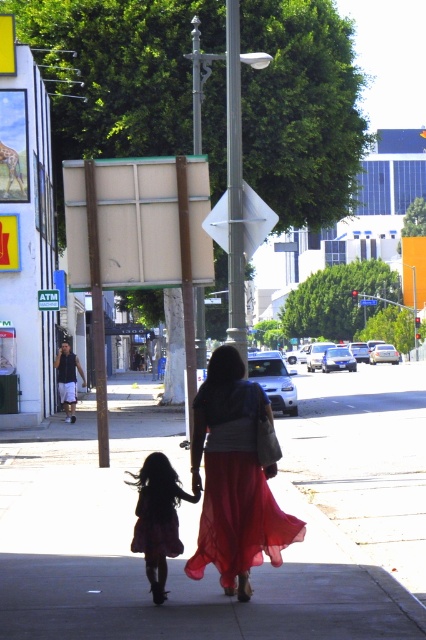
Does point (86, 628) come closer to viewer compared to point (213, 529)?

Yes, it is.

Is smooth concrete sidewalk at center in front of red chiffon dress at center?

Yes, it is in front of red chiffon dress at center.

Which is behind, point (186, 552) or point (204, 563)?

The point (186, 552) is behind.

Identify the location of smooth concrete sidewalk at center. (198, 515).

Does smooth concrete sidewalk at center have a smaller size compared to silky purple dress at lower left?

Actually, smooth concrete sidewalk at center might be larger than silky purple dress at lower left.

Is point (385, 579) in front of point (170, 512)?

No, it is not.

Where is `smooth concrete sidewalk at center`? smooth concrete sidewalk at center is located at coordinates (198, 515).

Which is more to the left, red chiffon dress at center or silky purple dress at lower left?

From the viewer's perspective, silky purple dress at lower left appears more on the left side.

Looking at this image, is the position of red chiffon dress at center more distant than that of silky purple dress at lower left?

That is False.

Where is `red chiffon dress at center`? red chiffon dress at center is located at coordinates (235, 484).